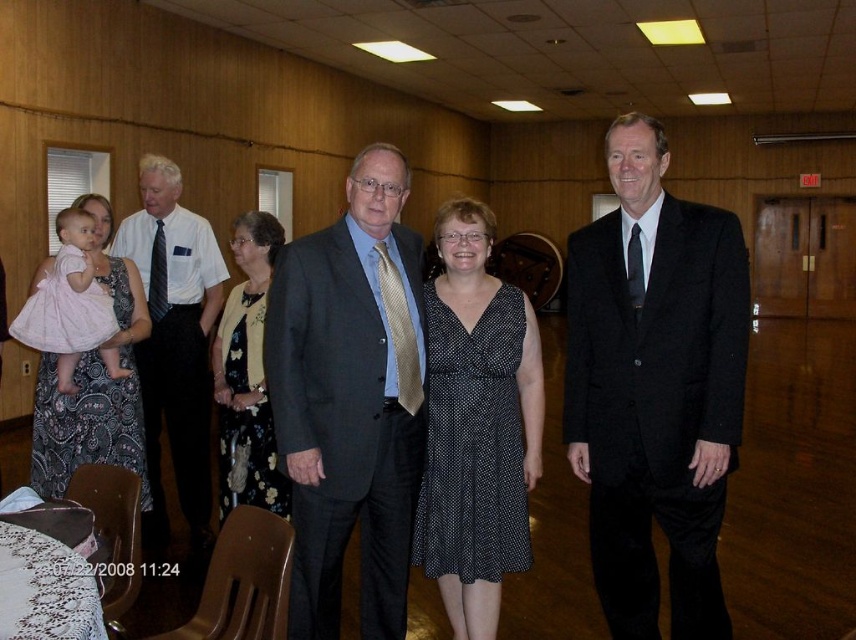
Question: Considering the real-world distances, which object is closest to the black dotted dress at center?

Choices:
 (A) matte pink dress at left
 (B) matte gray suit at center
 (C) black wool suit at center

Answer: (B)

Question: Which point appears farthest from the camera in this image?

Choices:
 (A) (132, 444)
 (B) (503, 492)

Answer: (A)

Question: Does black wool suit at center have a larger size compared to matte white shirt at center?

Choices:
 (A) yes
 (B) no

Answer: (A)

Question: Considering the relative positions of matte gray suit at center and pink satin dress at left in the image provided, where is matte gray suit at center located with respect to pink satin dress at left?

Choices:
 (A) left
 (B) right

Answer: (B)

Question: Does black dotted dress at center appear on the right side of matte white shirt at center?

Choices:
 (A) no
 (B) yes

Answer: (B)

Question: Which object is positioned farthest from the black dotted dress at center?

Choices:
 (A) floral-patterned fabric dress at center
 (B) matte gray suit at center

Answer: (A)